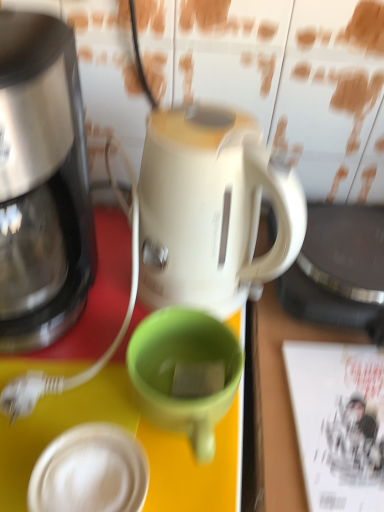
Question: Is white paper magazine at right smaller than white matte lid at lower left?

Choices:
 (A) yes
 (B) no

Answer: (B)

Question: From a real-world perspective, is white paper magazine at right located higher than white matte lid at lower left?

Choices:
 (A) no
 (B) yes

Answer: (A)

Question: Is white paper magazine at right not inside white matte lid at lower left?

Choices:
 (A) no
 (B) yes

Answer: (B)

Question: Is white paper magazine at right next to white matte lid at lower left?

Choices:
 (A) no
 (B) yes

Answer: (A)

Question: From a real-world perspective, is white paper magazine at right located beneath white matte lid at lower left?

Choices:
 (A) yes
 (B) no

Answer: (A)

Question: Considering the relative sizes of white paper magazine at right and white matte lid at lower left in the image provided, is white paper magazine at right thinner than white matte lid at lower left?

Choices:
 (A) yes
 (B) no

Answer: (B)

Question: Can you confirm if white matte lid at lower left is wider than white paper magazine at right?

Choices:
 (A) no
 (B) yes

Answer: (A)

Question: Is white paper magazine at right at the back of white matte lid at lower left?

Choices:
 (A) no
 (B) yes

Answer: (A)

Question: From the image's perspective, does white matte lid at lower left appear lower than white paper magazine at right?

Choices:
 (A) no
 (B) yes

Answer: (B)

Question: Does white matte lid at lower left have a smaller size compared to white paper magazine at right?

Choices:
 (A) yes
 (B) no

Answer: (A)

Question: Does white matte lid at lower left appear on the right side of white paper magazine at right?

Choices:
 (A) no
 (B) yes

Answer: (A)

Question: Is white matte lid at lower left taller than white paper magazine at right?

Choices:
 (A) yes
 (B) no

Answer: (A)

Question: Is green matte mug at center at the left side of shiny metallic coffee maker at left?

Choices:
 (A) yes
 (B) no

Answer: (B)